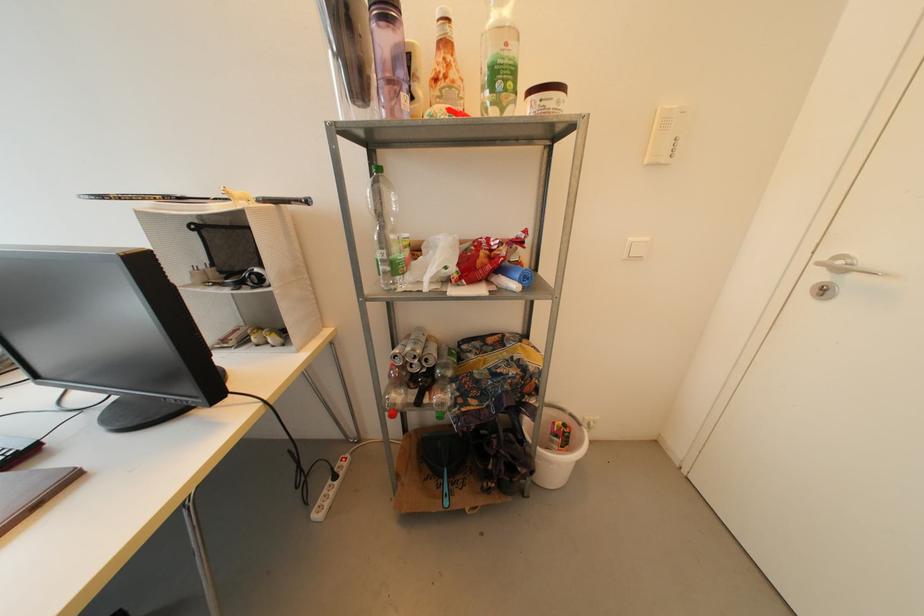
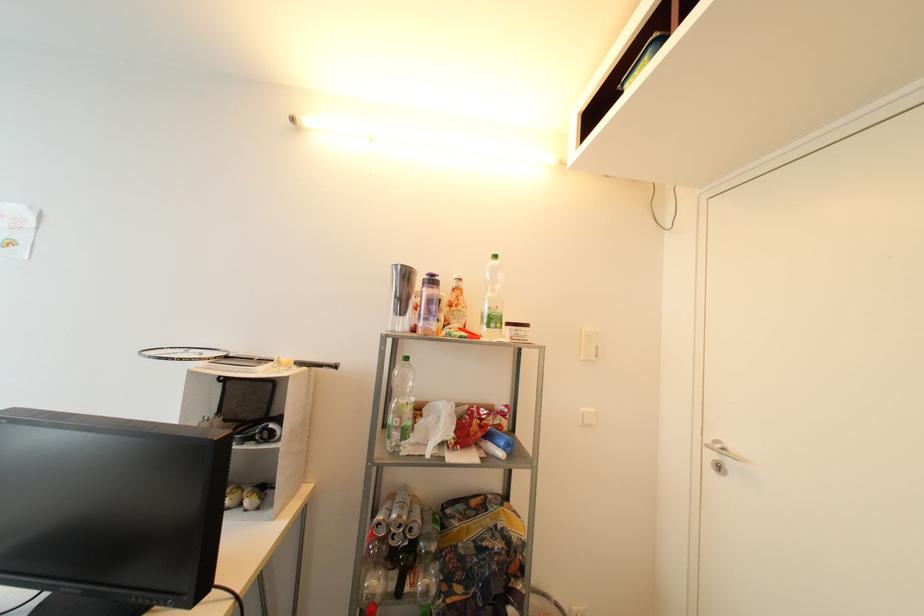
The point at [450,79] is marked in the first image. Where is the corresponding point in the second image?

(462, 307)